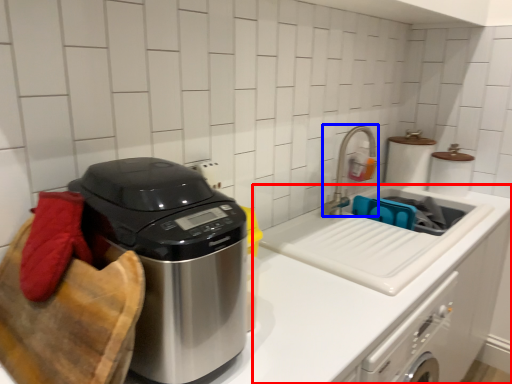
Question: Which point is further to the camera, counter (highlighted by a red box) or faucet (highlighted by a blue box)?

Choices:
 (A) counter
 (B) faucet

Answer: (B)